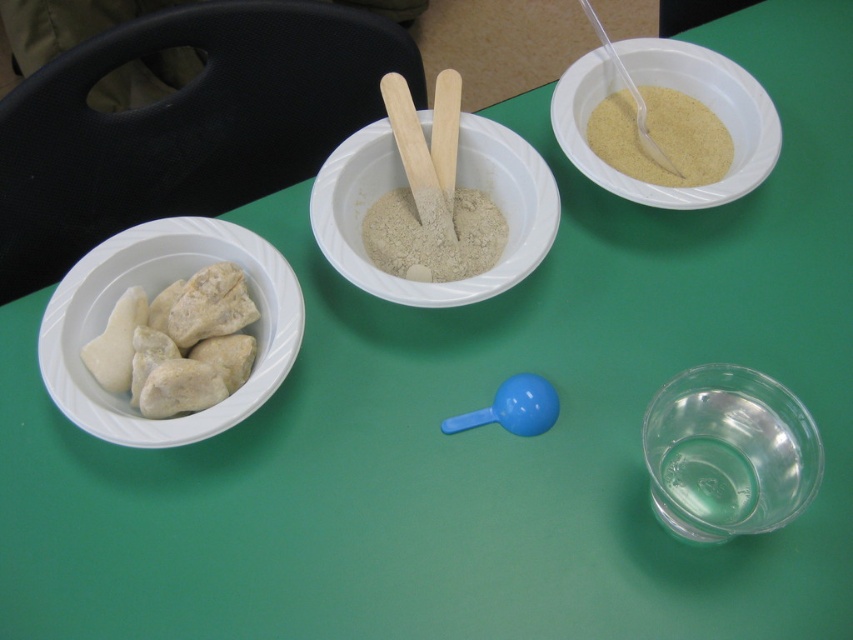
You are a student trying to determine which object is higher in the image. You see the white stone rocks at left and the yellowish powder at upper right. Which one is taller?

The white stone rocks at left is much taller than the yellowish powder at upper right according to the description.